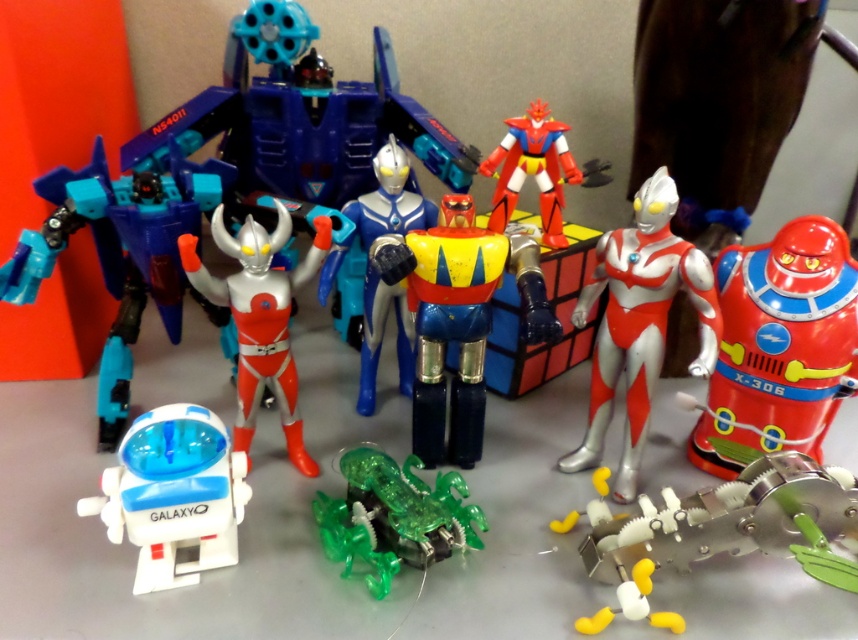
Between matte blue plastic robot at left and shiny silver figure at center, which one has more height?

matte blue plastic robot at left

Can you confirm if matte blue plastic robot at left is positioned to the left of shiny silver figure at center?

Indeed, matte blue plastic robot at left is positioned on the left side of shiny silver figure at center.

Between point (64, 204) and point (663, 268), which one is positioned behind?

The point (64, 204) is behind.

Where is `matte blue plastic robot at left`? The height and width of the screenshot is (640, 858). matte blue plastic robot at left is located at coordinates (118, 253).

In the scene shown: Does metallic silver gear at lower right have a greater width compared to matte blue plastic robot at left?

Yes.

Is point (820, 529) positioned after point (142, 275)?

No, it is not.

Between point (846, 582) and point (168, 248), which one is positioned behind?

The point (168, 248) is behind.

Identify the location of metallic silver gear at lower right. The width and height of the screenshot is (858, 640). (724, 531).

Between metallic silver gear at lower right and transparent green creature at center, which one is positioned lower?

Positioned lower is metallic silver gear at lower right.

Is point (630, 595) positioned behind point (376, 534)?

No, (630, 595) is in front of (376, 534).

This screenshot has height=640, width=858. I want to click on metallic silver gear at lower right, so click(x=724, y=531).